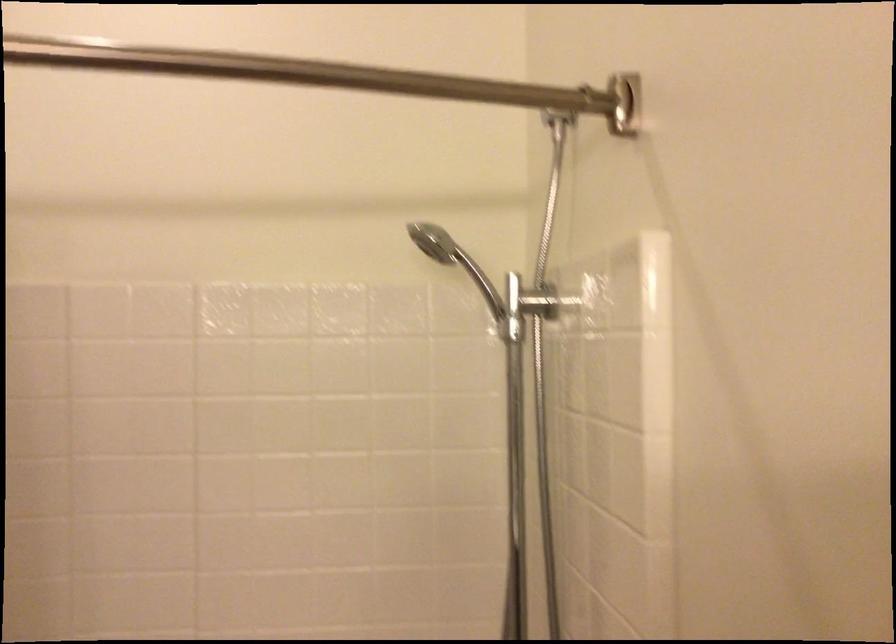
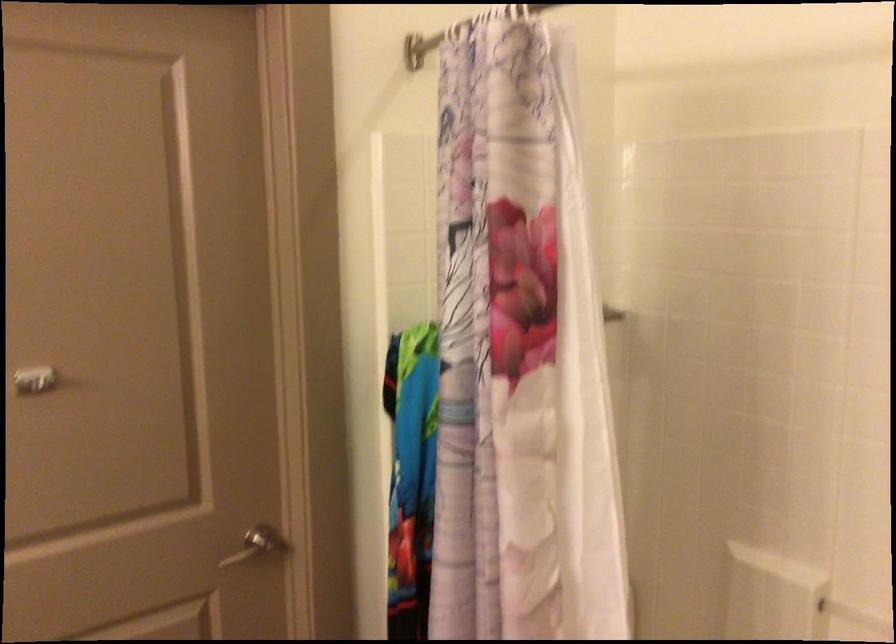
Question: The first image is from the beginning of the video and the second image is from the end. How did the camera likely rotate when shooting the video?

Choices:
 (A) Left
 (B) Right
 (C) Up
 (D) Down

Answer: (A)